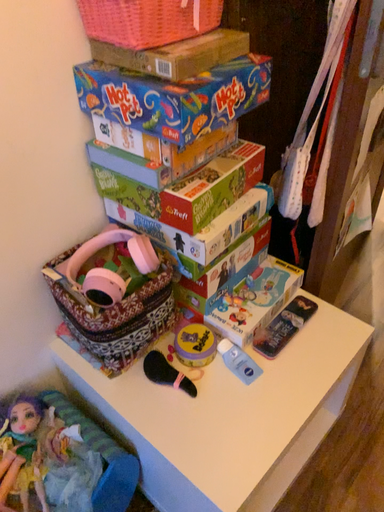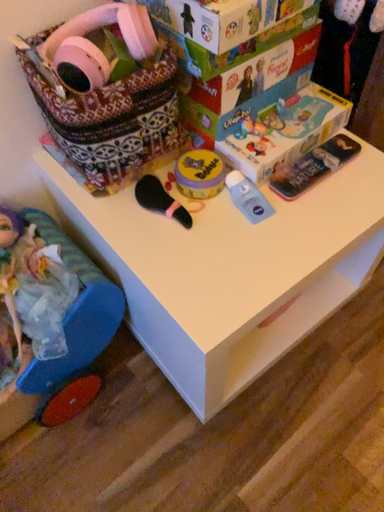
Question: How did the camera likely rotate when shooting the video?

Choices:
 (A) rotated left
 (B) rotated right

Answer: (A)